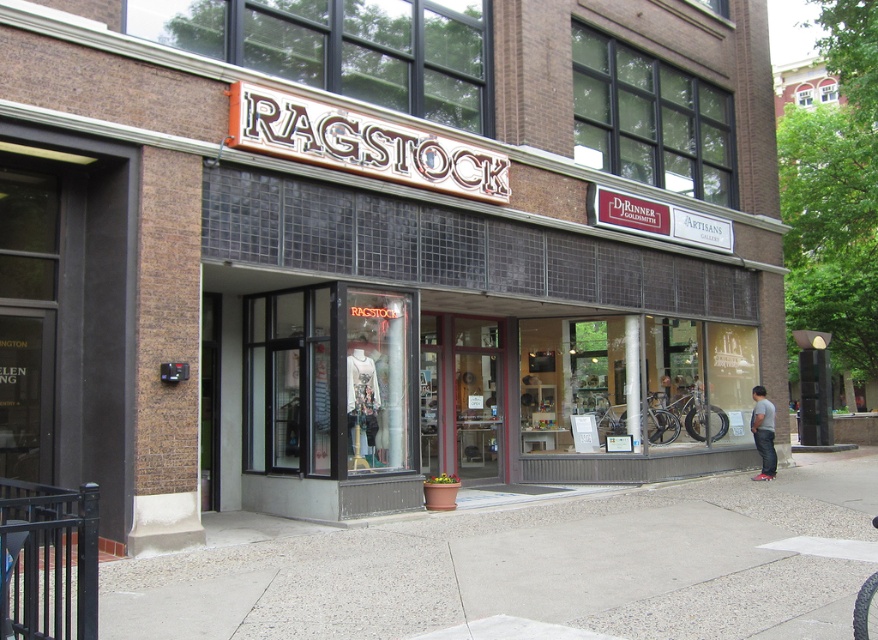
Does point (409, 596) come closer to viewer compared to point (763, 477)?

Yes, it is.

Is gray concrete pavement at center above gray cotton shirt at lower right?

No.

Between point (723, 529) and point (766, 460), which one is positioned in front?

Point (723, 529) is more forward.

Identify the location of gray concrete pavement at center. (530, 564).